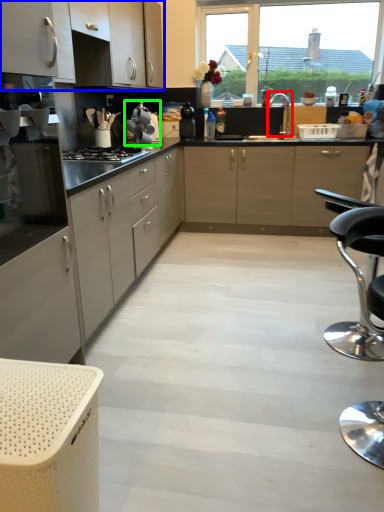
Question: Based on their relative distances, which object is nearer to tap (highlighted by a red box)? Choose from cabinetry (highlighted by a blue box) and kitchen appliance (highlighted by a green box).

Choices:
 (A) cabinetry
 (B) kitchen appliance

Answer: (B)